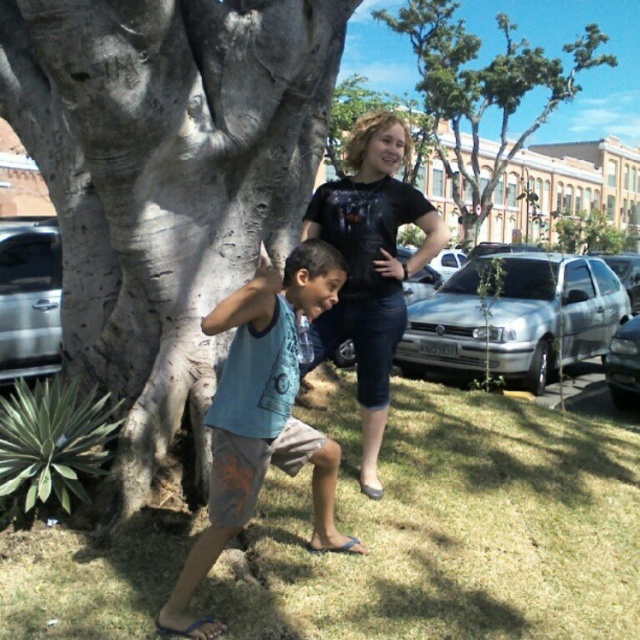
Between green grass at lower center and blue cotton tank top at center, which one appears on the right side from the viewer's perspective?

green grass at lower center

Does green grass at lower center have a larger size compared to blue cotton tank top at center?

Yes, green grass at lower center is bigger than blue cotton tank top at center.

Is point (506, 518) positioned behind point (186, 564)?

Yes, point (506, 518) is farther from viewer.

In order to click on green grass at lower center in this screenshot , I will do `click(454, 529)`.

Consider the image. Can you confirm if gray rough bark tree at center is thinner than blue cotton tank top at center?

Incorrect, gray rough bark tree at center's width is not less than blue cotton tank top at center's.

Is gray rough bark tree at center smaller than blue cotton tank top at center?

Incorrect, gray rough bark tree at center is not smaller in size than blue cotton tank top at center.

Is point (305, 86) less distant than point (248, 502)?

No.

The width and height of the screenshot is (640, 640). I want to click on gray rough bark tree at center, so click(x=166, y=179).

Between green grass at lower center and black t-shirt at center, which one has less height?

Standing shorter between the two is green grass at lower center.

In the scene shown: Does green grass at lower center have a greater width compared to black t-shirt at center?

Correct, the width of green grass at lower center exceeds that of black t-shirt at center.

What are the coordinates of `green grass at lower center` in the screenshot? It's located at (454, 529).